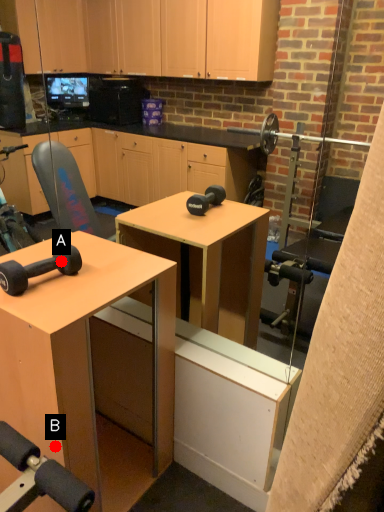
Question: Two points are circled on the image, labeled by A and B beside each circle. Which point is further to the camera?

Choices:
 (A) A is further
 (B) B is further

Answer: (A)